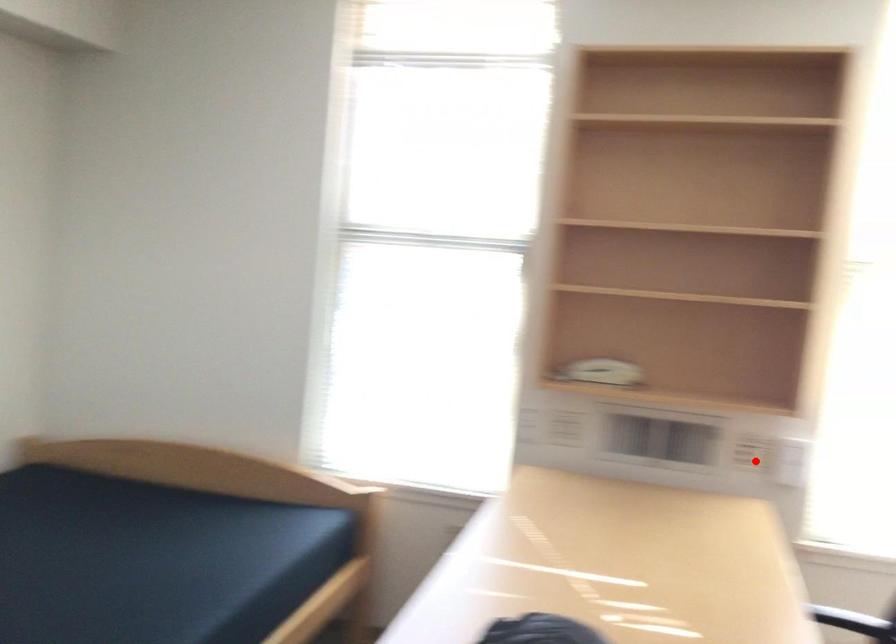
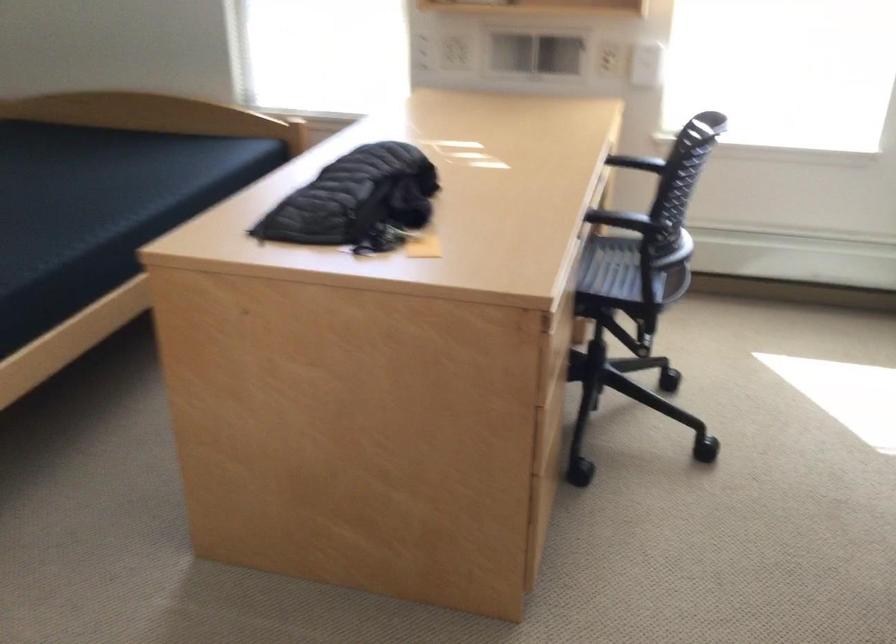
Question: I am providing you with two images of the same scene from different viewpoints. Image1 has a red point marked. In image2, the corresponding 3D location appears at what relative position? Reply with the corresponding letter.

Choices:
 (A) Closer
 (B) Farther

Answer: (B)